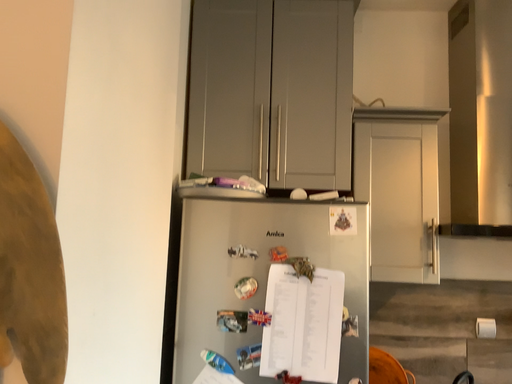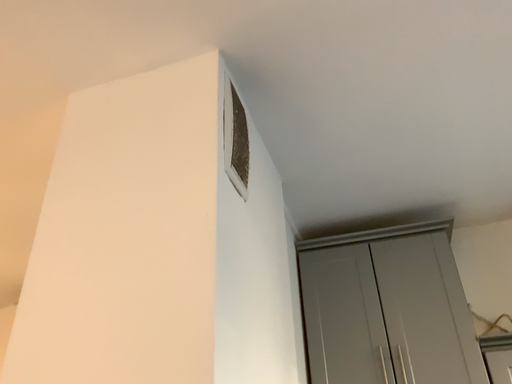
Question: Which way did the camera rotate in the video?

Choices:
 (A) rotated downward
 (B) rotated upward

Answer: (B)